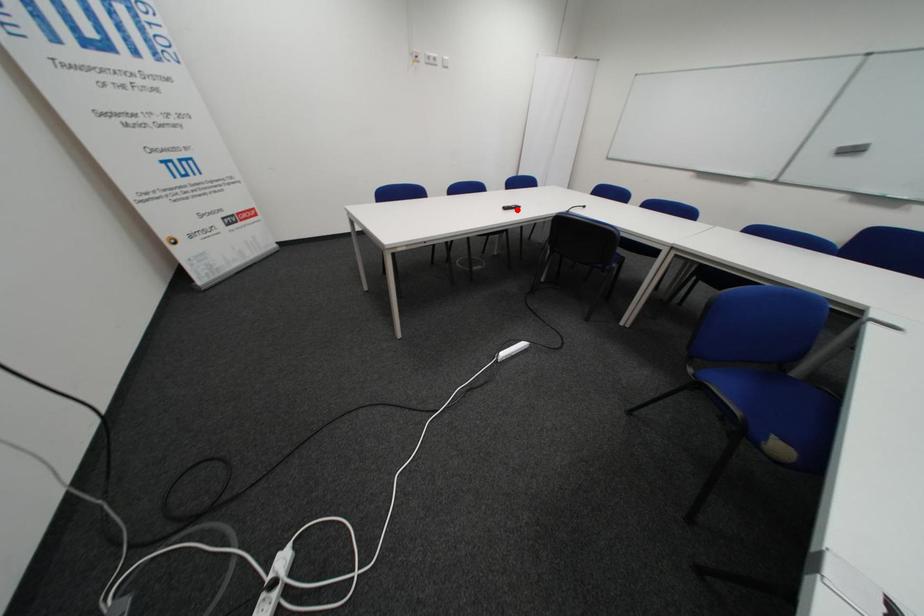
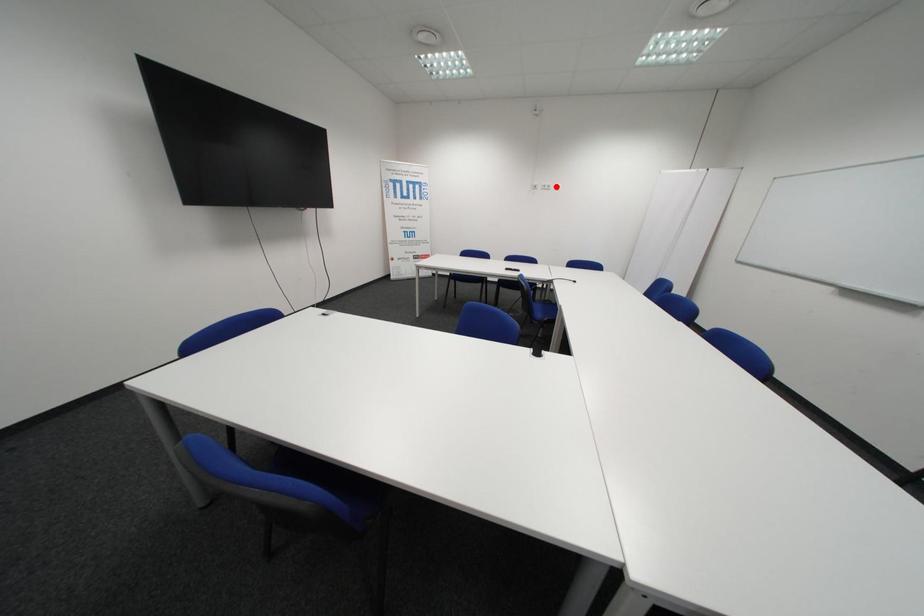
I am providing you with two images of the same scene from different viewpoints. A red point is marked on the first image and another point is marked on the second image. Are the points marked in image1 and image2 representing the same 3D position?

No